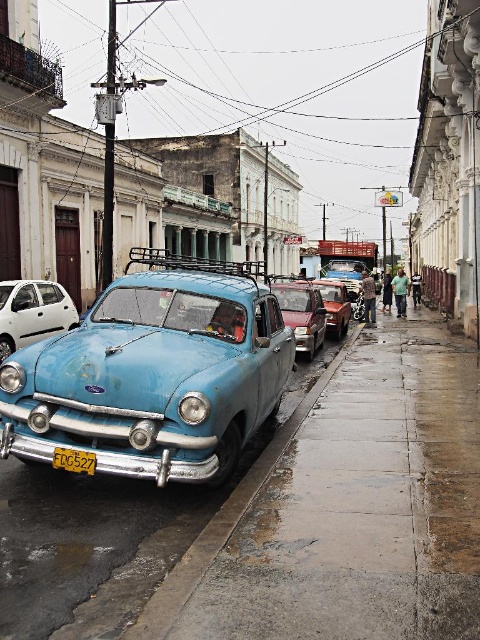
Is rusty metal car at center wider than yellow matte license plate at center?

Yes.

Who is more forward, (279, 294) or (62, 454)?

Positioned in front is point (62, 454).

You are a GUI agent. You are given a task and a screenshot of the screen. Output one action in this format:
    pyautogui.click(x=<x>, y=<y>)
    Task: Click on the rusty metal car at center
    
    Given the screenshot: What is the action you would take?
    [301, 312]

Which is more to the left, rusty blue car at left or metallic red car at center?

From the viewer's perspective, rusty blue car at left appears more on the left side.

The image size is (480, 640). What do you see at coordinates (155, 372) in the screenshot?
I see `rusty blue car at left` at bounding box center [155, 372].

Is point (204, 310) closer to viewer compared to point (334, 317)?

Yes.

At what (x,y) coordinates should I click in order to perform the action: click on rusty blue car at left. Please return your answer as a coordinate pair (x, y). Looking at the image, I should click on (155, 372).

Measure the distance from white matte car at left to rusty metal car at center.

They are 5.02 meters apart.

Based on the photo, is white matte car at left closer to the viewer compared to rusty metal car at center?

No, it is not.

This screenshot has width=480, height=640. What are the coordinates of `white matte car at left` in the screenshot? It's located at (33, 312).

At what (x,y) coordinates should I click in order to perform the action: click on white matte car at left. Please return your answer as a coordinate pair (x, y). The image size is (480, 640). Looking at the image, I should click on (33, 312).